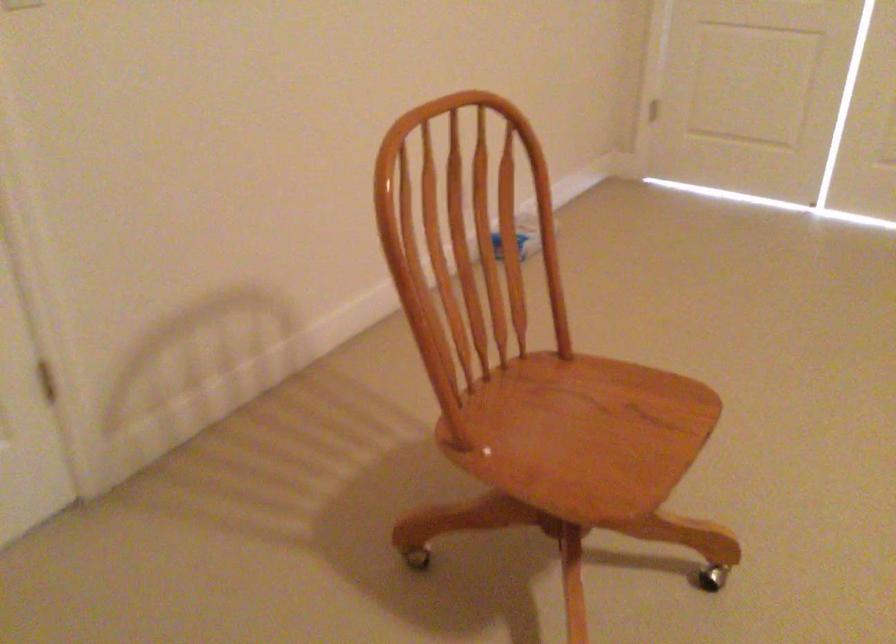
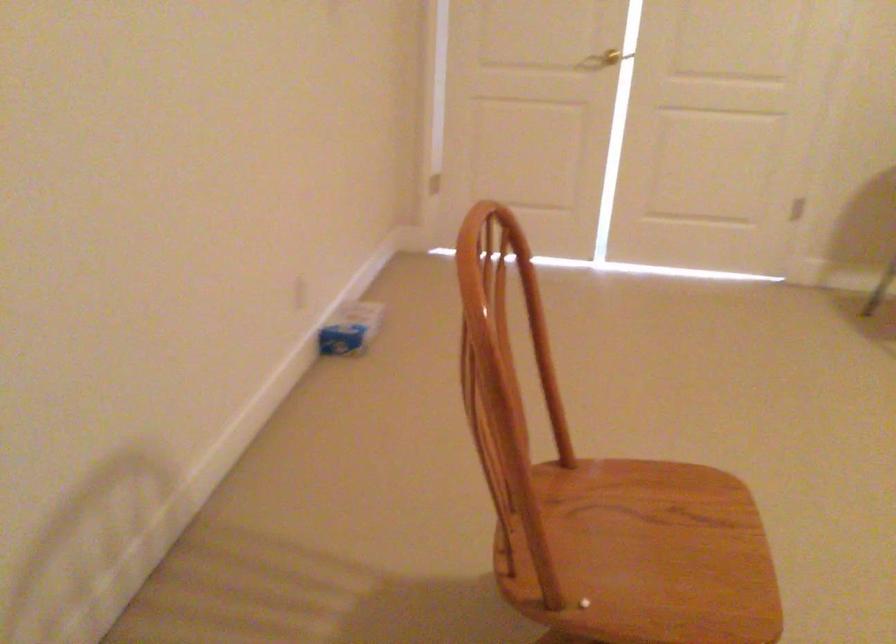
Question: The first image is from the beginning of the video and the second image is from the end. How did the camera likely rotate when shooting the video?

Choices:
 (A) Left
 (B) Right
 (C) Up
 (D) Down

Answer: (B)